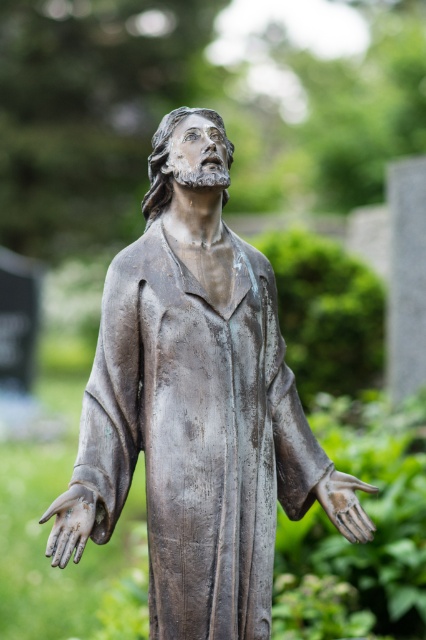
Question: Is bronze statue at center closer to camera compared to bronze textured hand at lower right?

Choices:
 (A) no
 (B) yes

Answer: (B)

Question: Which of the following is the closest to the observer?

Choices:
 (A) (66, 502)
 (B) (212, 276)
 (C) (336, 518)

Answer: (A)

Question: Can you confirm if bronze statue at center is bigger than bronze textured hand at lower right?

Choices:
 (A) no
 (B) yes

Answer: (B)

Question: Observing the image, what is the correct spatial positioning of bronze textured hand at lower left in reference to bronze textured hand at lower right?

Choices:
 (A) above
 (B) below

Answer: (B)

Question: Which object is closer to the camera taking this photo?

Choices:
 (A) bronze textured hand at lower right
 (B) bronze textured hand at lower left
 (C) bronze statue at center

Answer: (B)

Question: Which object is farther from the camera taking this photo?

Choices:
 (A) bronze textured hand at lower right
 (B) bronze statue at center

Answer: (A)